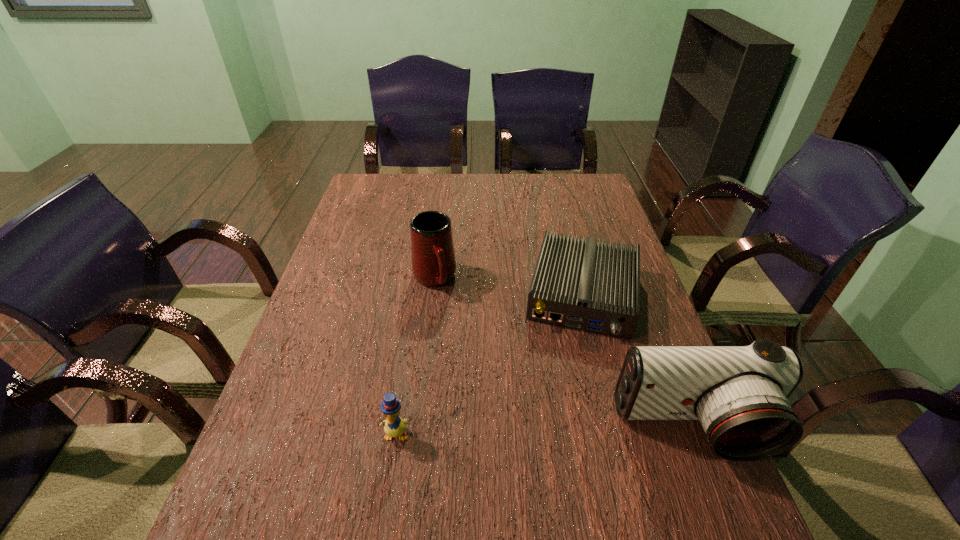
This screenshot has height=540, width=960. I want to click on free spot between the duckling and the mug, so click(x=415, y=356).

Where is `vacant region between the second shortest object and the router`? The width and height of the screenshot is (960, 540). vacant region between the second shortest object and the router is located at coordinates (489, 364).

At what (x,y) coordinates should I click in order to perform the action: click on empty space that is in between the shortest object and the third tallest object. Please return your answer as a coordinate pair (x, y). Looking at the image, I should click on (489, 364).

This screenshot has width=960, height=540. What are the coordinates of `empty space between the mug and the duckling` in the screenshot? It's located at (415, 356).

You are a GUI agent. You are given a task and a screenshot of the screen. Output one action in this format:
    pyautogui.click(x=<x>, y=<y>)
    Task: Click on the vacant region between the mug and the camcorder
    Image resolution: width=960 pixels, height=540 pixels.
    Given the screenshot: What is the action you would take?
    pyautogui.click(x=564, y=354)

The image size is (960, 540). In order to click on free space between the router and the mug in this screenshot , I will do `click(509, 287)`.

Where is `unoccupied position between the router and the third tallest object`? unoccupied position between the router and the third tallest object is located at coordinates (489, 364).

Find the location of a particular element. Image resolution: width=960 pixels, height=540 pixels. free area in between the duckling and the shortest object is located at coordinates (489, 364).

Find the location of `object that is the second closest to the mug`. object that is the second closest to the mug is located at coordinates (394, 426).

Identify which object is the second nearest to the third tallest object. Please provide its 2D coordinates. Your answer should be formatted as a tuple, i.e. [(x, y)], where the tuple contains the x and y coordinates of a point satisfying the conditions above.

[(433, 257)]